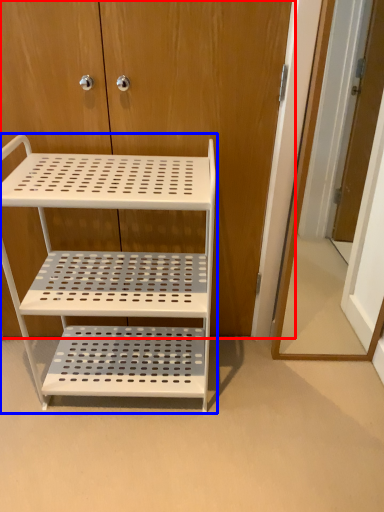
Question: Which point is further to the camera, dresser (highlighted by a red box) or shelf (highlighted by a blue box)?

Choices:
 (A) dresser
 (B) shelf

Answer: (A)